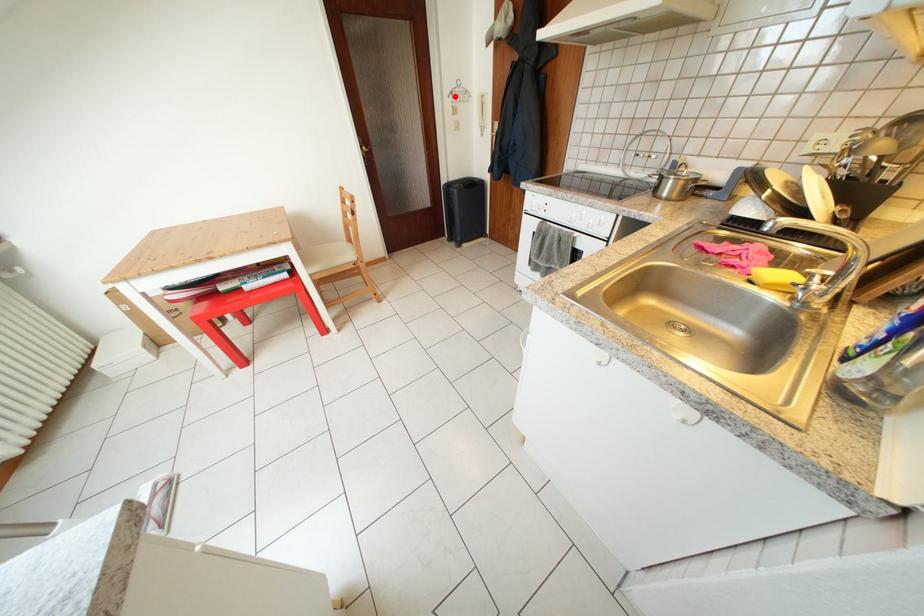
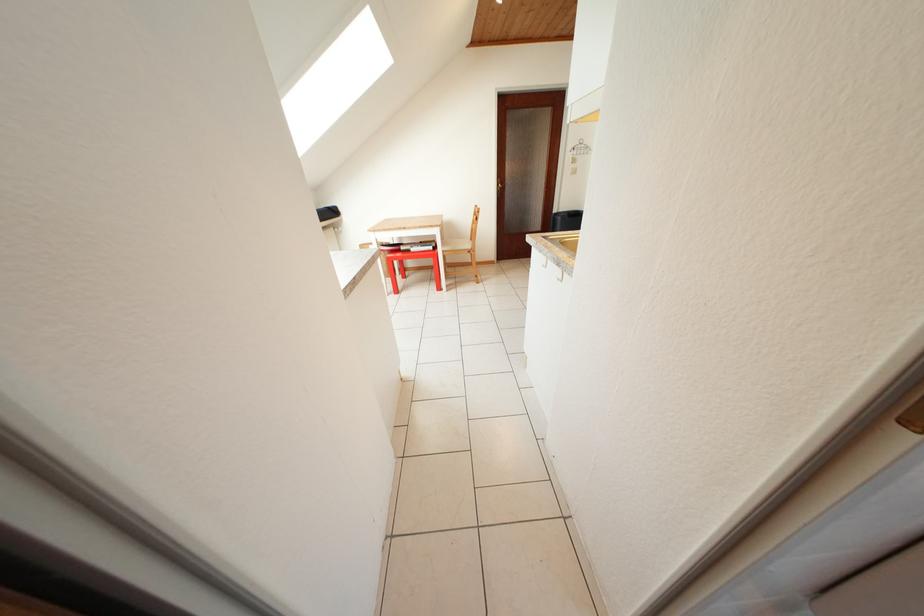
Where in the second image is the point corresponding to the highlighted location from the first image?

(578, 153)